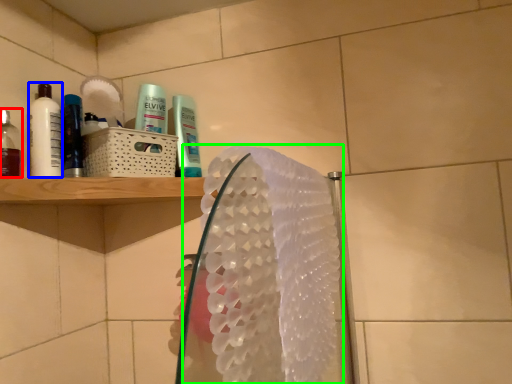
Question: Which object is positioned farthest from mouthwash (highlighted by a red box)? Select from mouthwash (highlighted by a blue box) and hand towel (highlighted by a green box).

Choices:
 (A) mouthwash
 (B) hand towel

Answer: (B)